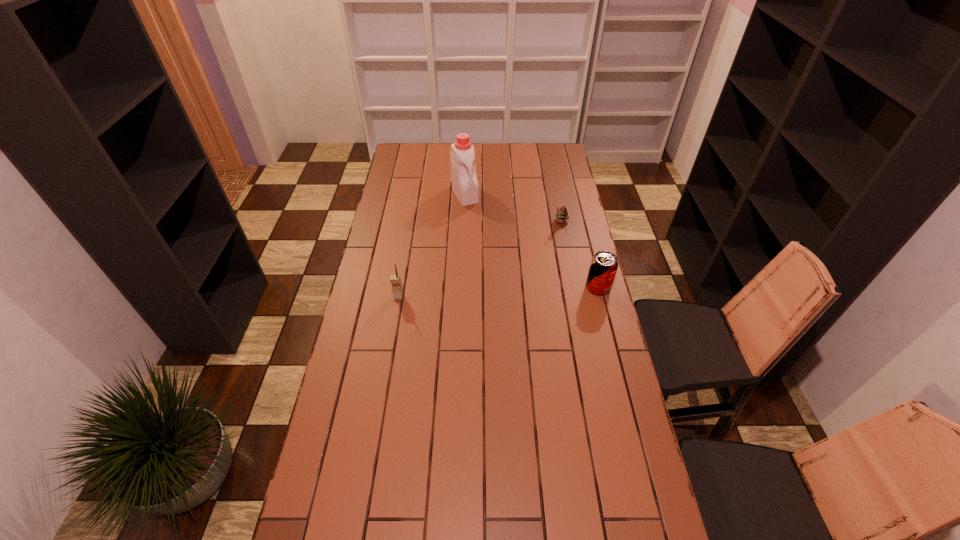
Locate an element on the screen. This screenshot has width=960, height=540. cellular telephone is located at coordinates (395, 279).

Locate an element on the screen. The image size is (960, 540). soda can is located at coordinates (604, 264).

The height and width of the screenshot is (540, 960). I want to click on the rightmost object, so click(x=604, y=264).

Find the location of a particular element. detergent is located at coordinates (465, 185).

Find the location of a particular element. The height and width of the screenshot is (540, 960). the farthest object is located at coordinates (465, 185).

What are the coordinates of `the third object from left to right` in the screenshot? It's located at click(x=562, y=214).

This screenshot has width=960, height=540. In order to click on the shortest object in this screenshot , I will do `click(562, 214)`.

The height and width of the screenshot is (540, 960). In order to click on free space located 0.090m on the front of the leftmost object, where the keypad is located in this screenshot , I will do `click(395, 320)`.

You are a GUI agent. You are given a task and a screenshot of the screen. Output one action in this format:
    pyautogui.click(x=<x>, y=<y>)
    Task: Click on the vacant space situated on the back of the rightmost object
    The image size is (960, 540).
    Given the screenshot: What is the action you would take?
    pyautogui.click(x=592, y=266)

Identify the location of free space located 0.310m on the handle side of the tallest object. This screenshot has width=960, height=540. (492, 248).